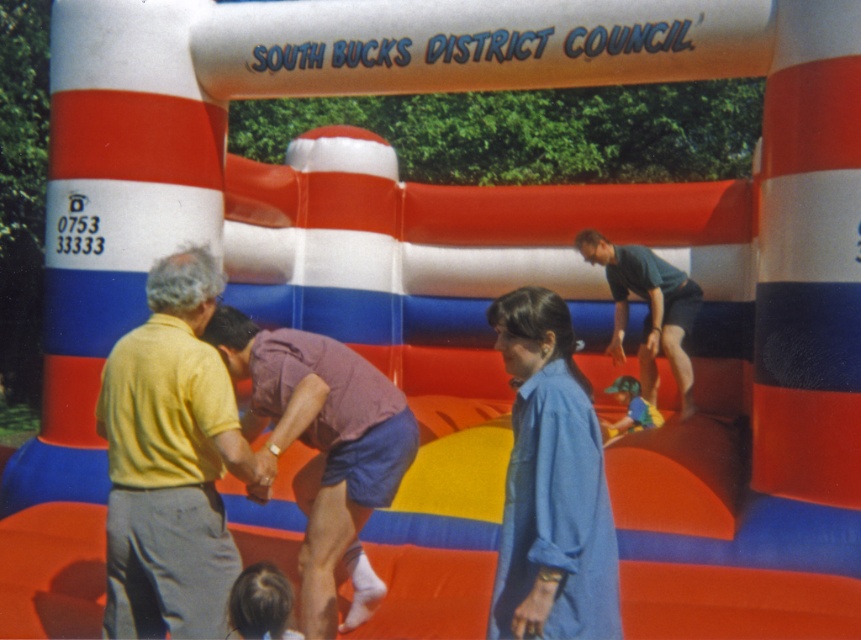
Is dark green t-shirt at upper right shorter than blonde hair at lower left?

Incorrect, dark green t-shirt at upper right's height does not fall short of blonde hair at lower left's.

Measure the distance from dark green t-shirt at upper right to blonde hair at lower left.

dark green t-shirt at upper right is 14.81 feet from blonde hair at lower left.

Where is `dark green t-shirt at upper right`? The image size is (861, 640). dark green t-shirt at upper right is located at coordinates (649, 308).

Consider the image. Is blue cotton shirt at center smaller than dark green t-shirt at upper right?

Yes, blue cotton shirt at center is smaller than dark green t-shirt at upper right.

Which is behind, point (542, 538) or point (630, 262)?

Point (630, 262)

Which is in front, point (617, 628) or point (667, 316)?

Positioned in front is point (617, 628).

The height and width of the screenshot is (640, 861). Identify the location of blue cotton shirt at center. (550, 484).

Can you confirm if blonde hair at lower left is positioned to the right of blue fabric shirt at center?

In fact, blonde hair at lower left is to the left of blue fabric shirt at center.

Can you confirm if blonde hair at lower left is thinner than blue fabric shirt at center?

Yes, blonde hair at lower left is thinner than blue fabric shirt at center.

Does point (246, 612) lie in front of point (624, 388)?

Yes, it is.

Image resolution: width=861 pixels, height=640 pixels. I want to click on blonde hair at lower left, so click(261, 604).